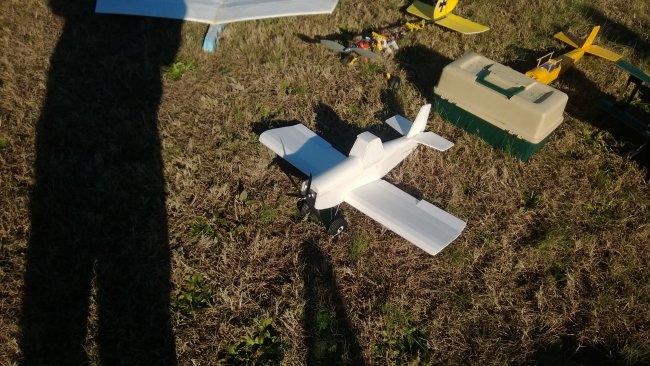
In order to click on hinge in this screenshot , I will do `click(513, 136)`, `click(447, 96)`.